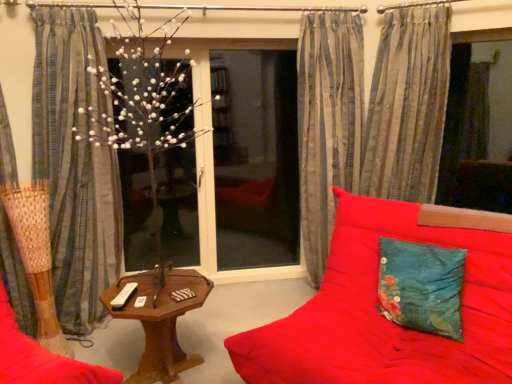
Question: Considering the relative sizes of white matte tree at center and transparent glass window screen at right, the second window screen in the left-to-right sequence, in the image provided, is white matte tree at center wider than transparent glass window screen at right, the second window screen in the left-to-right sequence,?

Choices:
 (A) no
 (B) yes

Answer: (A)

Question: From a real-world perspective, is white matte tree at center physically above transparent glass window screen at right, marked as the first window screen in a right-to-left arrangement?

Choices:
 (A) no
 (B) yes

Answer: (A)

Question: Does white matte tree at center touch transparent glass window screen at right, marked as the first window screen in a right-to-left arrangement?

Choices:
 (A) no
 (B) yes

Answer: (A)

Question: Is white matte tree at center shorter than transparent glass window screen at right, marked as the first window screen in a right-to-left arrangement?

Choices:
 (A) no
 (B) yes

Answer: (A)

Question: Does white matte tree at center have a smaller size compared to transparent glass window screen at right, marked as the first window screen in a right-to-left arrangement?

Choices:
 (A) yes
 (B) no

Answer: (B)

Question: Considering the relative sizes of white matte tree at center and transparent glass window screen at right, marked as the first window screen in a right-to-left arrangement, in the image provided, is white matte tree at center bigger than transparent glass window screen at right, marked as the first window screen in a right-to-left arrangement,?

Choices:
 (A) no
 (B) yes

Answer: (B)

Question: Is white matte tree at center facing away from transparent glass screen door at center?

Choices:
 (A) no
 (B) yes

Answer: (A)

Question: Considering the relative sizes of white matte tree at center and transparent glass screen door at center in the image provided, is white matte tree at center smaller than transparent glass screen door at center?

Choices:
 (A) yes
 (B) no

Answer: (A)

Question: Would you say white matte tree at center is a long distance from transparent glass screen door at center?

Choices:
 (A) yes
 (B) no

Answer: (A)

Question: Does white matte tree at center have a larger size compared to transparent glass screen door at center?

Choices:
 (A) yes
 (B) no

Answer: (B)

Question: Is white matte tree at center closer to the viewer compared to transparent glass screen door at center?

Choices:
 (A) yes
 (B) no

Answer: (A)

Question: Is white matte tree at center at the right side of transparent glass screen door at center?

Choices:
 (A) no
 (B) yes

Answer: (A)

Question: Is striped fabric curtain at right, which appears as the 1th curtain when viewed from the right, taller than teal fabric cushion at right?

Choices:
 (A) yes
 (B) no

Answer: (A)